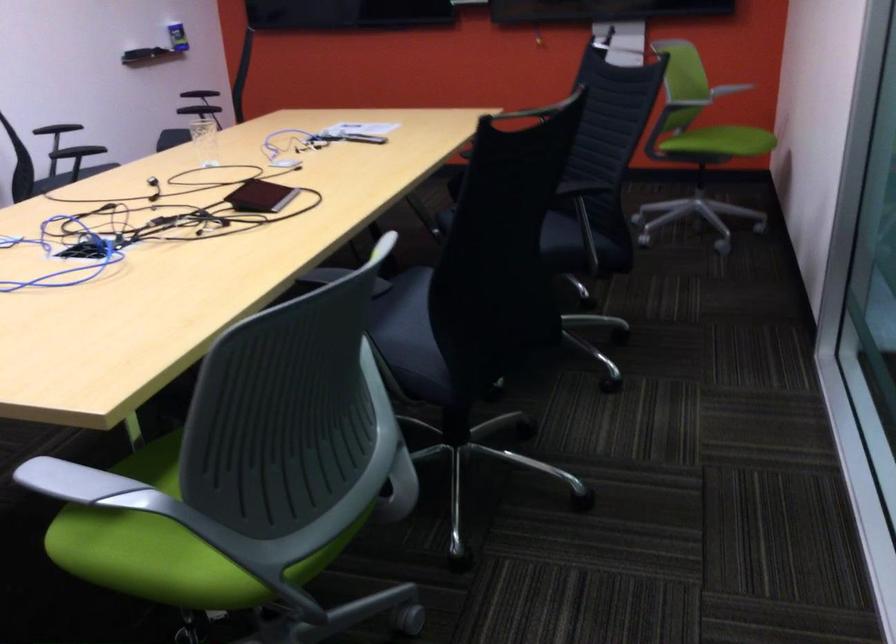
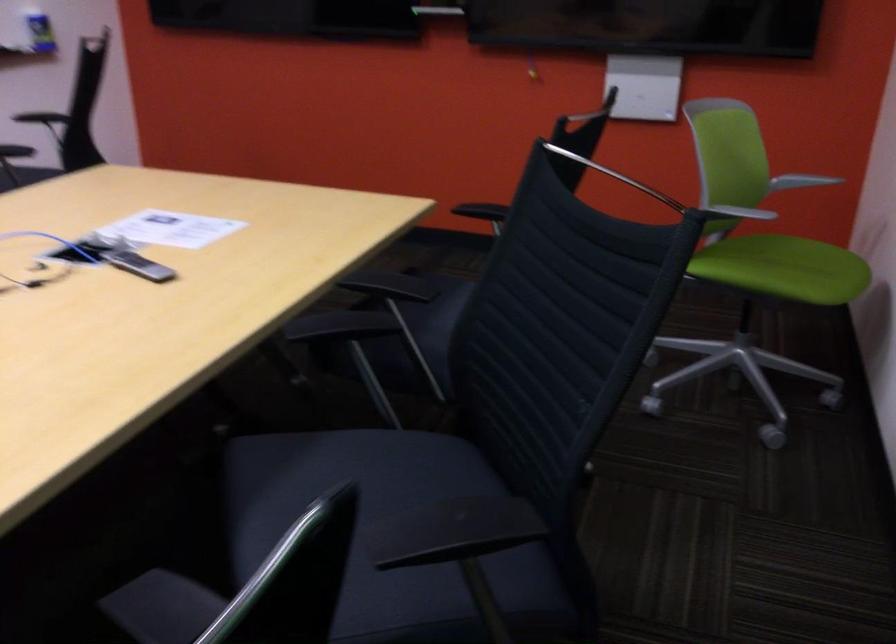
Question: Which direction would the cameraman need to move to produce the second image? Reply with the corresponding letter.

Choices:
 (A) Left
 (B) Right
 (C) Forward
 (D) Backward

Answer: (C)